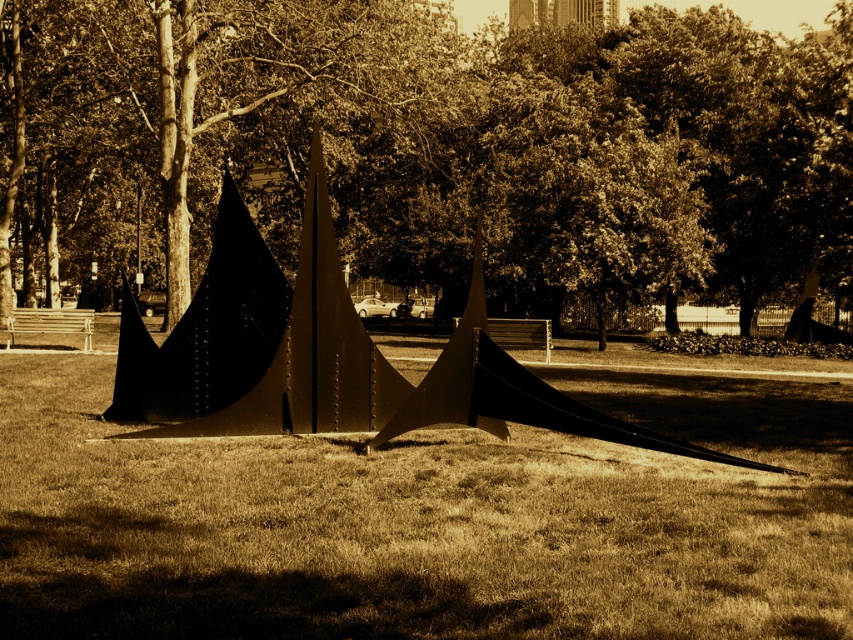
Which is in front, point (802, 586) or point (506, 356)?

Point (802, 586) is in front.

Is point (514, 449) closer to viewer compared to point (332, 307)?

Yes, point (514, 449) is closer to viewer.

Where is `brown matte grass at center`? This screenshot has width=853, height=640. brown matte grass at center is located at coordinates (430, 518).

Where is `brown matte grass at center`? brown matte grass at center is located at coordinates (430, 518).

Based on the photo, is brown textured tree at upper center below metallic gold pyramid at center?

No.

Describe the element at coordinates (437, 147) in the screenshot. I see `brown textured tree at upper center` at that location.

Locate an element on the screen. Image resolution: width=853 pixels, height=640 pixels. brown textured tree at upper center is located at coordinates (437, 147).

Does point (296, 74) come in front of point (578, 378)?

No.

Does brown textured tree at upper center have a lesser height compared to brown matte grass at center?

No.

Is point (734, 140) positioned behind point (273, 525)?

Yes, it is behind point (273, 525).

Identify the location of brown textured tree at upper center. pos(437,147).